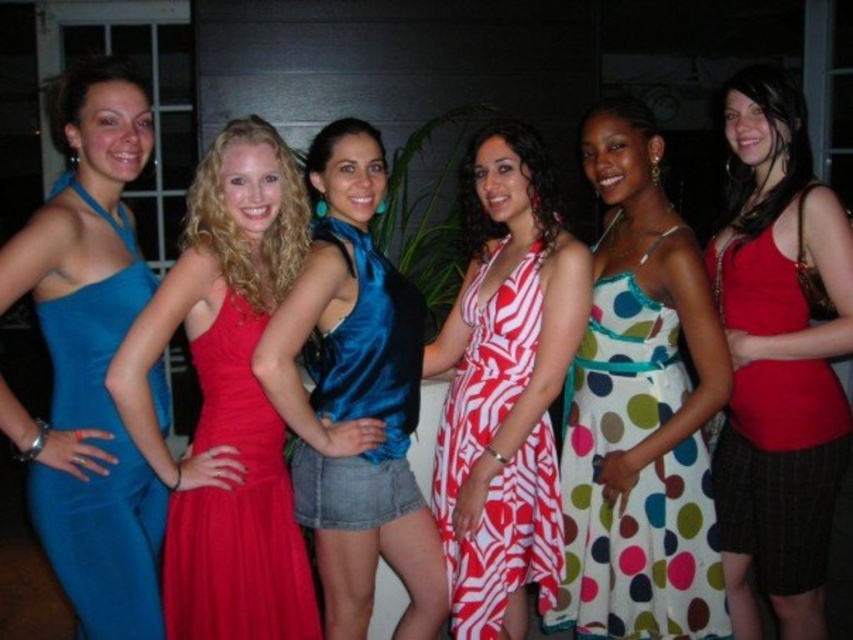
Can you confirm if satin blue top at center is wider than multicolored polka dot dress at center?

In fact, satin blue top at center might be narrower than multicolored polka dot dress at center.

Does satin blue top at center have a lesser width compared to multicolored polka dot dress at center?

Yes.

This screenshot has width=853, height=640. What do you see at coordinates (355, 397) in the screenshot? I see `satin blue top at center` at bounding box center [355, 397].

Identify the location of satin blue top at center. This screenshot has width=853, height=640. (355, 397).

In the scene shown: Is matte blue dress at left further to the viewer compared to multicolored polka dot dress at center?

That is False.

Is point (61, 420) closer to camera compared to point (646, 554)?

Yes, point (61, 420) is in front of point (646, 554).

Who is more distant from viewer, (4, 429) or (613, 625)?

Point (613, 625)

At what (x,y) coordinates should I click in order to perform the action: click on matte blue dress at left. Please return your answer as a coordinate pair (x, y). This screenshot has width=853, height=640. Looking at the image, I should click on (90, 358).

Does red satin tank top at center have a smaller size compared to satin blue top at center?

Actually, red satin tank top at center might be larger than satin blue top at center.

Is red satin tank top at center positioned behind satin blue top at center?

Yes, it is behind satin blue top at center.

Does point (827, 246) lie in front of point (358, 252)?

Yes, it is in front of point (358, 252).

Locate an element on the screen. This screenshot has width=853, height=640. red satin tank top at center is located at coordinates (778, 360).